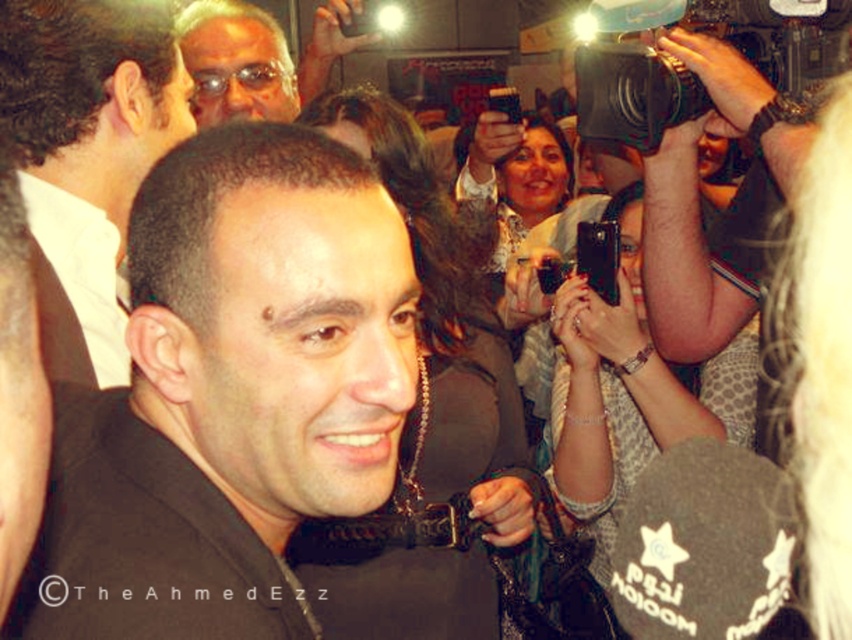
Is black satin suit at center closer to the viewer compared to black plastic video camera at upper right?

Yes.

Is point (281, 234) behind point (594, 83)?

No, it is not.

The width and height of the screenshot is (852, 640). What are the coordinates of `black satin suit at center` in the screenshot? It's located at (229, 396).

Is black satin suit at center positioned behind black glossy bow tie at center?

No, it is in front of black glossy bow tie at center.

Is black satin suit at center wider than black glossy bow tie at center?

Yes, black satin suit at center is wider than black glossy bow tie at center.

Identify the location of black satin suit at center. This screenshot has width=852, height=640. (229, 396).

The height and width of the screenshot is (640, 852). I want to click on black satin suit at center, so click(x=229, y=396).

Can you confirm if black glossy bow tie at center is positioned below black plastic video camera at upper right?

Indeed, black glossy bow tie at center is positioned under black plastic video camera at upper right.

Does black glossy bow tie at center have a lesser height compared to black plastic video camera at upper right?

No, black glossy bow tie at center is not shorter than black plastic video camera at upper right.

Where is `black glossy bow tie at center`? The image size is (852, 640). black glossy bow tie at center is located at coordinates (87, 156).